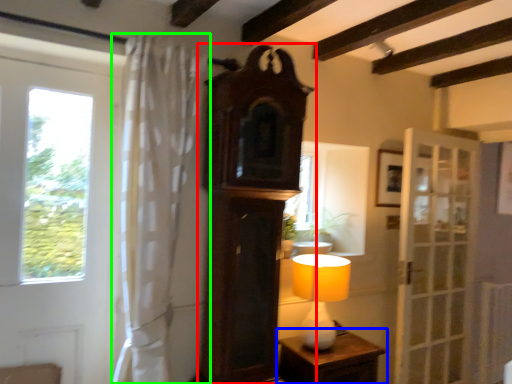
Question: Which object is the closest to the clock (highlighted by a red box)? Choose among these: nightstand (highlighted by a blue box) or curtain (highlighted by a green box).

Choices:
 (A) nightstand
 (B) curtain

Answer: (B)